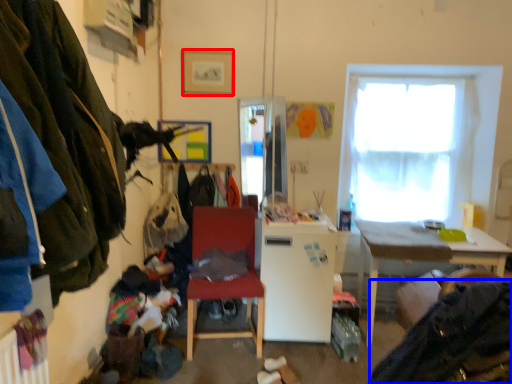
Question: Which object is further to the camera taking this photo, picture frame (highlighted by a red box) or clothing (highlighted by a blue box)?

Choices:
 (A) picture frame
 (B) clothing

Answer: (A)